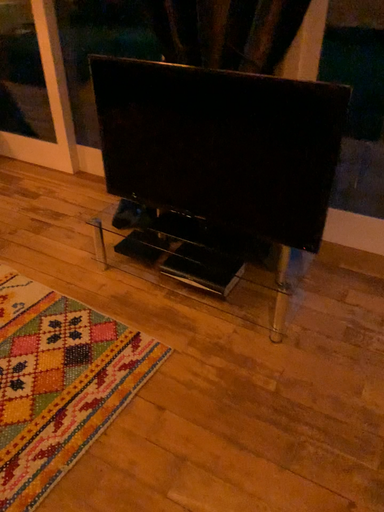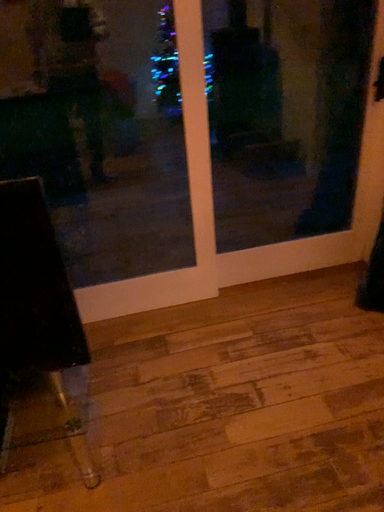
Question: Which way did the camera rotate in the video?

Choices:
 (A) rotated right
 (B) rotated left

Answer: (A)